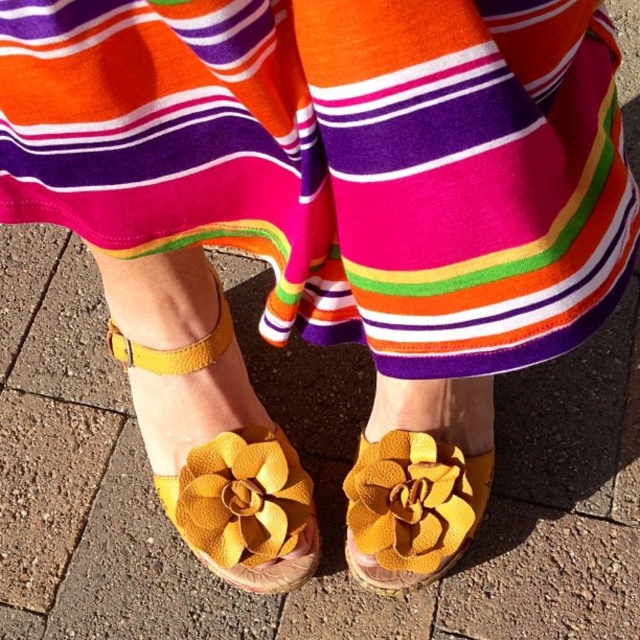
Between point (132, 349) and point (240, 516), which one is positioned in front?

Positioned in front is point (240, 516).

Based on the photo, is suede/yellow flower at center wider than matte yellow flower at center?

Correct, the width of suede/yellow flower at center exceeds that of matte yellow flower at center.

Is point (157, 280) behind point (257, 445)?

No, it is not.

Locate an element on the screen. This screenshot has width=640, height=640. suede/yellow flower at center is located at coordinates (211, 429).

Does leather flower at center have a larger size compared to matte yellow flower at center?

Yes, leather flower at center is bigger than matte yellow flower at center.

The width and height of the screenshot is (640, 640). Describe the element at coordinates (412, 508) in the screenshot. I see `leather flower at center` at that location.

Where is `leather flower at center`? leather flower at center is located at coordinates (412, 508).

Measure the distance between suede/yellow flower at center and camera.

suede/yellow flower at center is 73.80 centimeters from camera.

Can you confirm if suede/yellow flower at center is smaller than leather flower at center?

Incorrect, suede/yellow flower at center is not smaller in size than leather flower at center.

This screenshot has width=640, height=640. I want to click on suede/yellow flower at center, so 211,429.

I want to click on suede/yellow flower at center, so tap(211, 429).